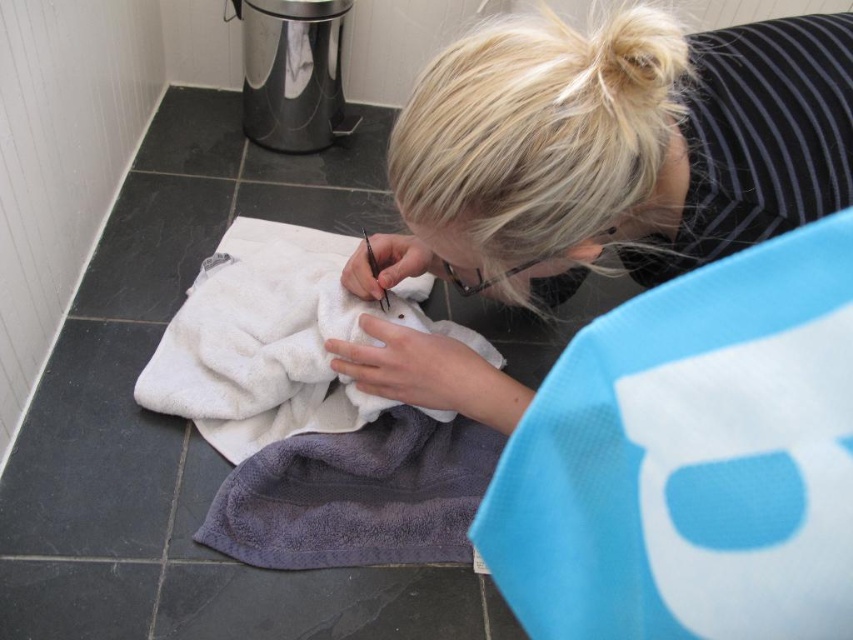
You are a guest in this bathroom and need to choose between the white soft towel at center and the gray terry towel at lower center to dry your hands. Which one is taller?

The white soft towel at center is much taller than the gray terry towel at lower center, so you should choose the white soft towel at center.

You are a photographer trying to capture the person working in the bathroom. You want to ensure the blonde hair at center and the white soft towel at center are both clearly visible in the photo. Based on their positions, which object should you focus on first to ensure both are in sharp focus?

The blonde hair at center is in front of the white soft towel at center. To ensure both are in sharp focus, you should focus on the white soft towel at center first since it is farther back, allowing the depth of field to cover the closer blonde hair at center as well.

You are a photographer trying to capture a closeup of the gray terry towel at lower center without the blonde hair at center blocking the view. Can you move the camera slightly to the side to avoid the hair?

The blonde hair at center is in front of the gray terry towel at lower center, so moving the camera to the side might help avoid the hair blocking the view.